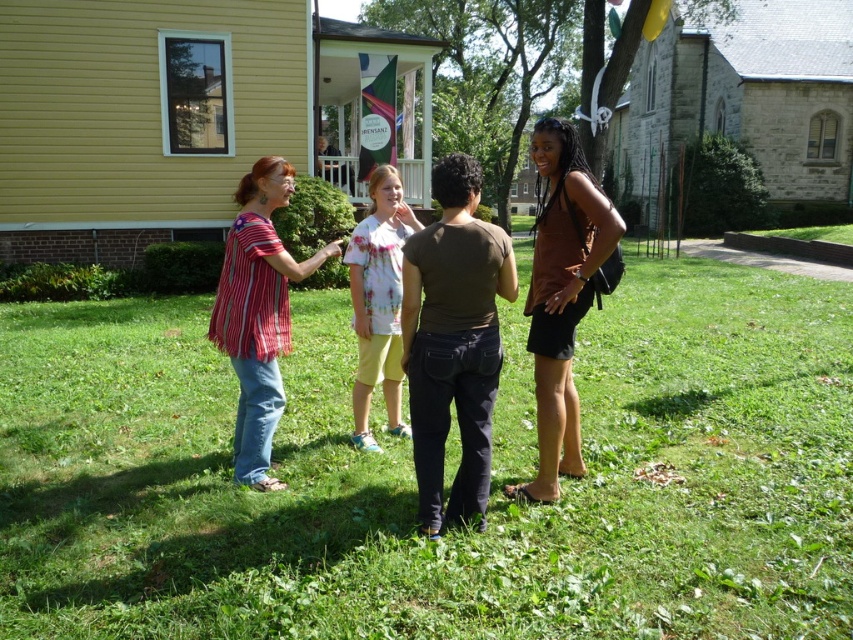
Question: Which object appears farthest from the camera in this image?

Choices:
 (A) striped cotton shirt at center
 (B) brown matte tank top at right

Answer: (A)

Question: Does green grass at center appear over floral t-shirt at center?

Choices:
 (A) yes
 (B) no

Answer: (B)

Question: Is brown matte tank top at right above floral t-shirt at center?

Choices:
 (A) no
 (B) yes

Answer: (B)

Question: Can you confirm if green grass at center is smaller than brown matte tank top at right?

Choices:
 (A) no
 (B) yes

Answer: (B)

Question: Which point is closer to the camera?

Choices:
 (A) (302, 336)
 (B) (548, 228)

Answer: (B)

Question: Which object appears farthest from the camera in this image?

Choices:
 (A) floral t-shirt at center
 (B) brown matte tank top at right
 (C) green grass at center

Answer: (A)